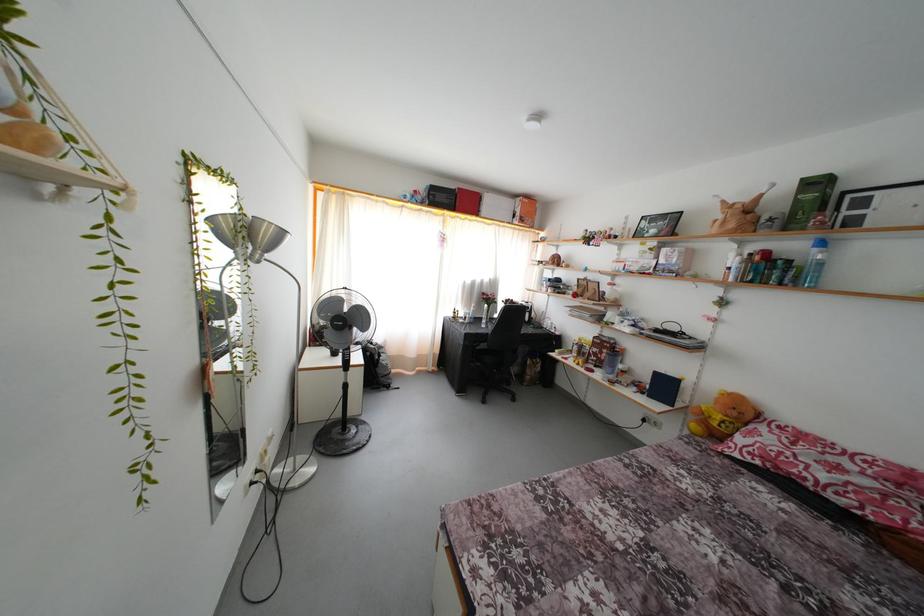
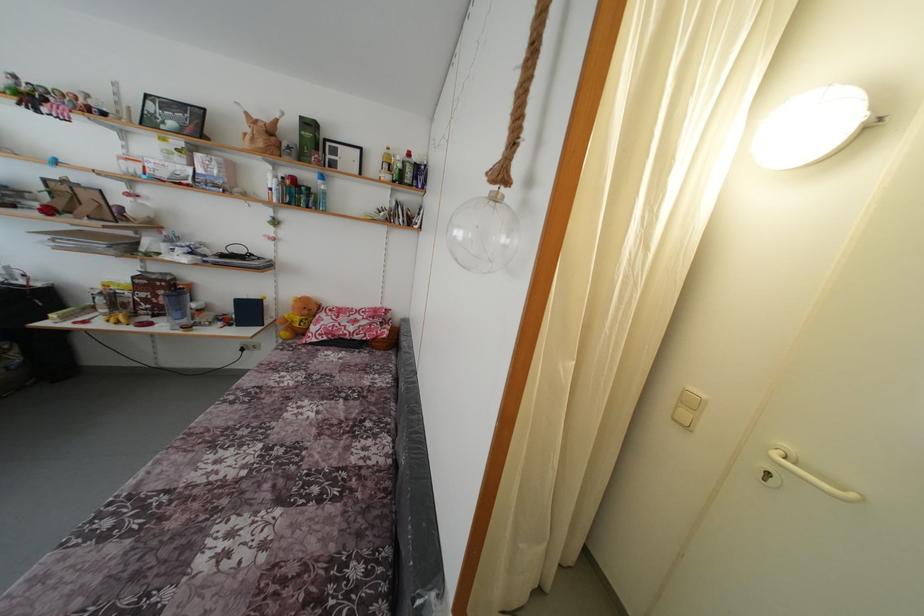
Where in the second image is the point corresponding to [821,256] from the first image?

(324, 188)